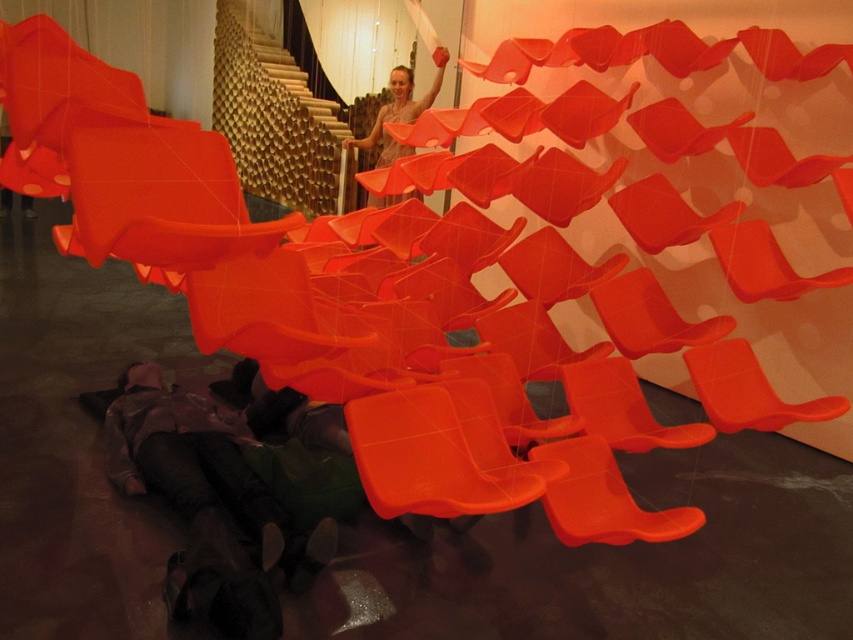
Question: Which point is closer to the camera taking this photo?

Choices:
 (A) (437, 54)
 (B) (286, 532)

Answer: (B)

Question: Observing the image, what is the correct spatial positioning of matte plastic chair at center in reference to matte orange fabric at upper center?

Choices:
 (A) left
 (B) right

Answer: (B)

Question: Which of these objects is positioned closest to the dark brown leather boots at lower left?

Choices:
 (A) matte orange fabric at upper center
 (B) matte plastic chair at center

Answer: (B)

Question: Is dark brown leather boots at lower left below matte plastic chair at center?

Choices:
 (A) no
 (B) yes

Answer: (B)

Question: Does dark brown leather boots at lower left come behind matte plastic chair at center?

Choices:
 (A) no
 (B) yes

Answer: (A)

Question: Which point is closer to the camera?

Choices:
 (A) (733, 348)
 (B) (386, 131)

Answer: (A)